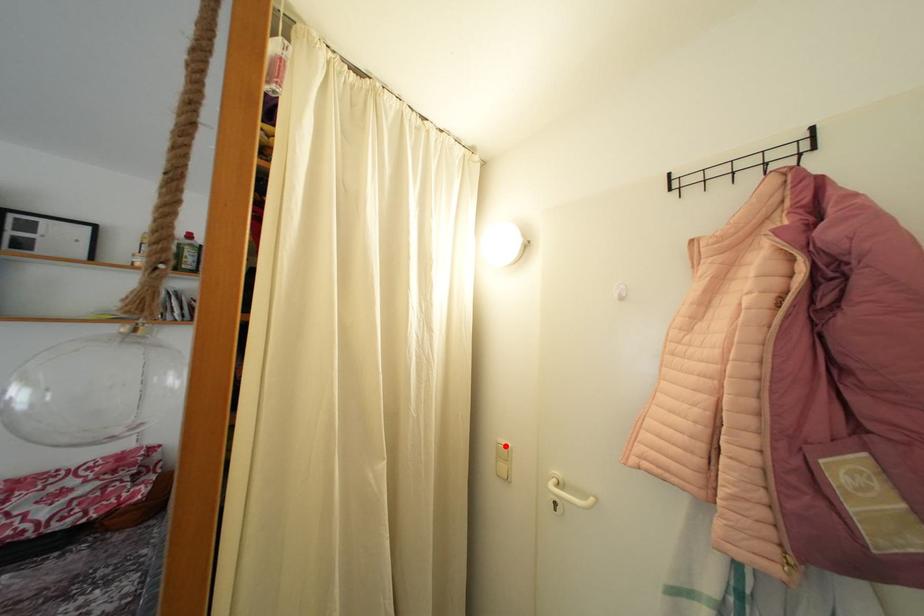
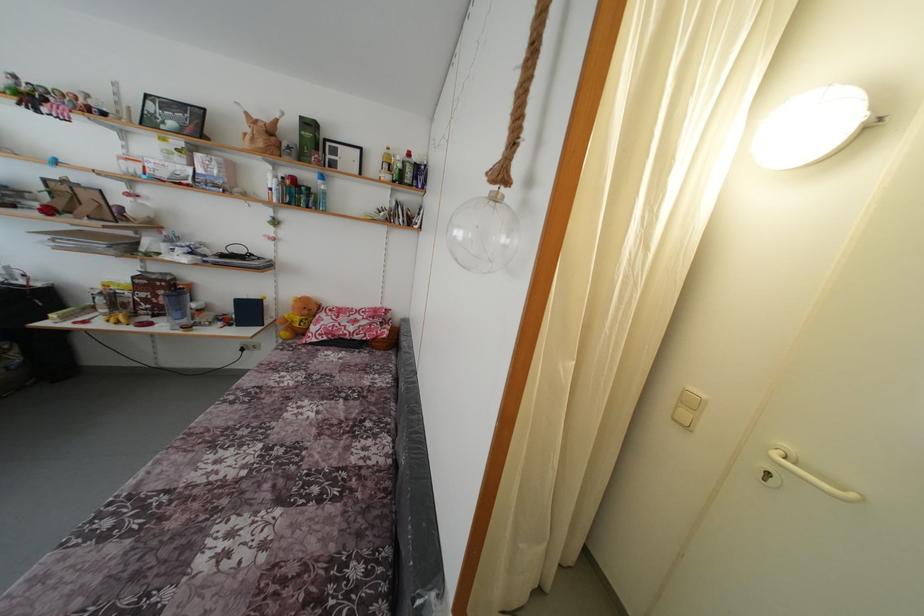
In the second image, find the point that corresponds to the highlighted location in the first image.

(696, 394)